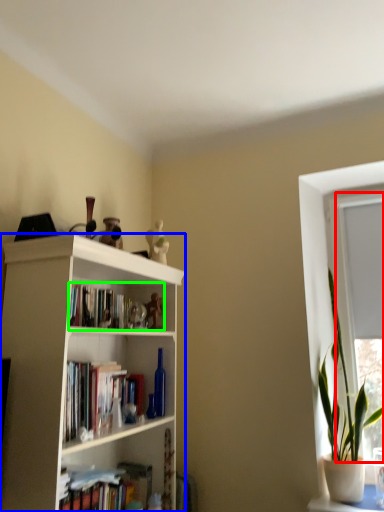
Question: Considering the real-world distances, which object is farthest from window frame (highlighted by a red box)? bookcase (highlighted by a blue box) or book (highlighted by a green box)?

Choices:
 (A) bookcase
 (B) book

Answer: (A)